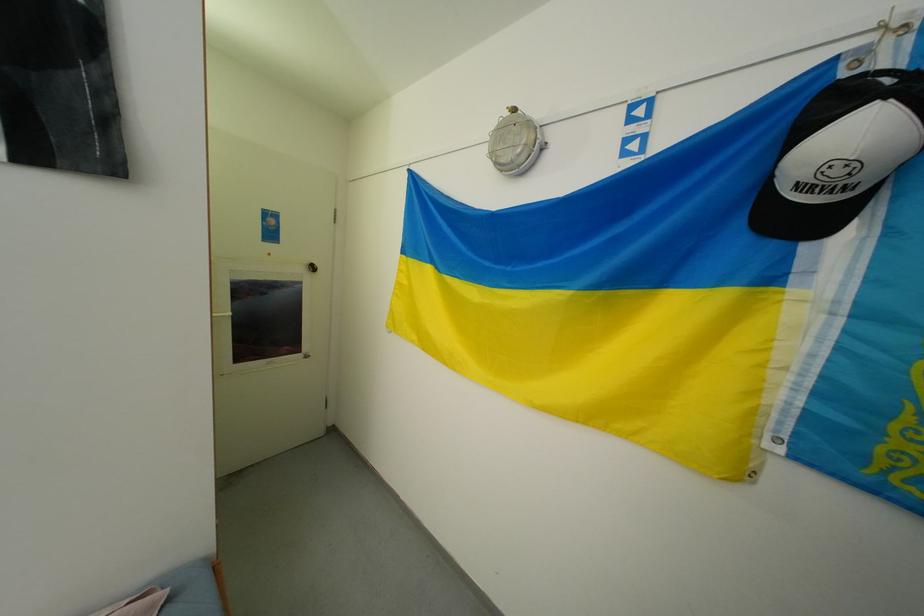
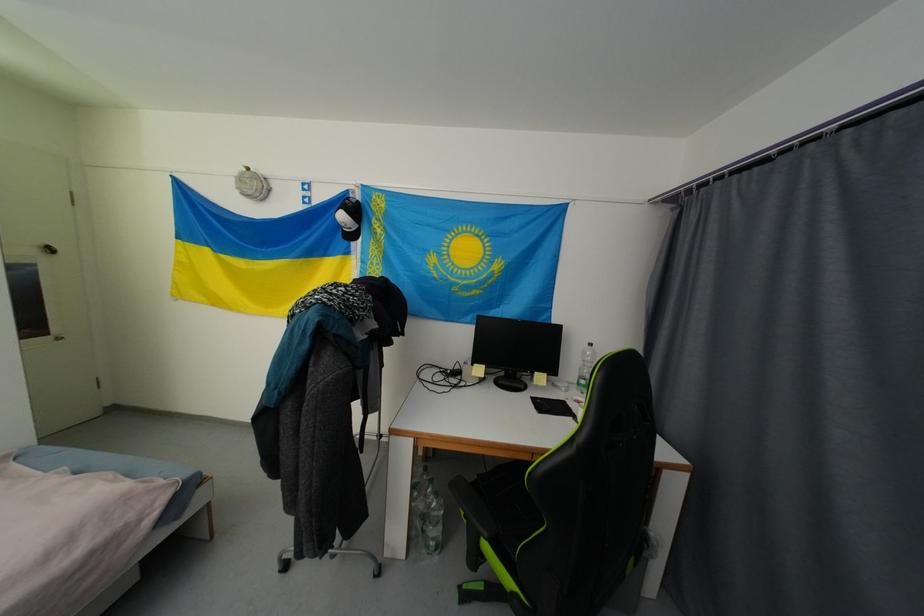
Where in the second image is the point corresponding to (896,81) from the first image?

(359, 203)